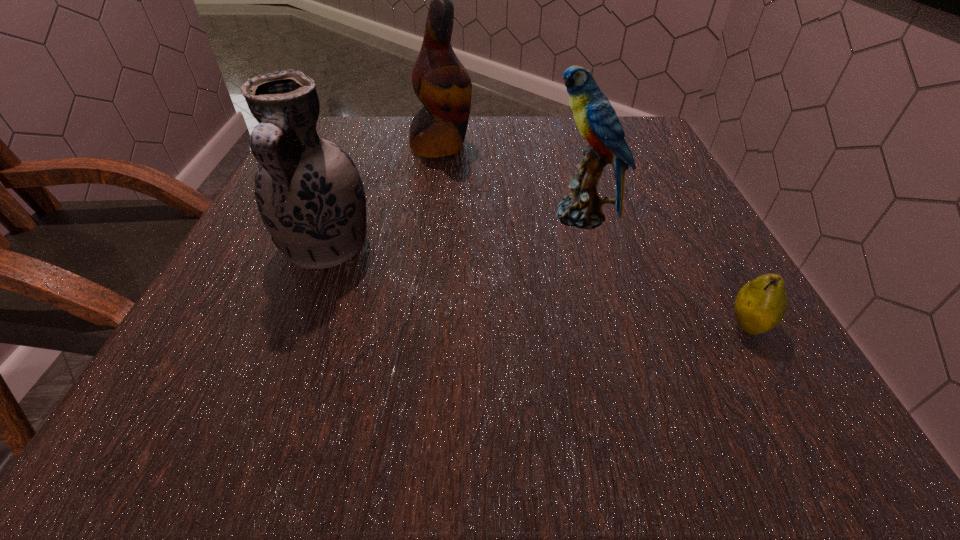
The image size is (960, 540). In order to click on free space located 0.390m on the face of the right parrot in this screenshot , I will do `click(335, 216)`.

This screenshot has width=960, height=540. Identify the location of vacant space situated 0.220m on the face of the right parrot. (427, 216).

The image size is (960, 540). Find the location of `vacant space situated on the back of the pear`. vacant space situated on the back of the pear is located at coordinates (701, 242).

Where is `object positioned at the far edge`? The height and width of the screenshot is (540, 960). object positioned at the far edge is located at coordinates (440, 81).

Locate an element on the screen. This screenshot has width=960, height=540. object located in the left edge section of the desktop is located at coordinates (309, 193).

The width and height of the screenshot is (960, 540). I want to click on parrot that is at the right edge, so click(596, 119).

You are a GUI agent. You are given a task and a screenshot of the screen. Output one action in this format:
    pyautogui.click(x=<x>, y=<y>)
    Task: Click on the pear that is positioned at the right edge
    
    Given the screenshot: What is the action you would take?
    [761, 304]

This screenshot has width=960, height=540. In the image, there is a desktop. In order to click on free region at the far edge in this screenshot , I will do `click(526, 135)`.

Identify the location of vacant space at the near edge. This screenshot has height=540, width=960. (599, 410).

This screenshot has width=960, height=540. In the image, there is a desktop. Identify the location of free space at the left edge. (292, 341).